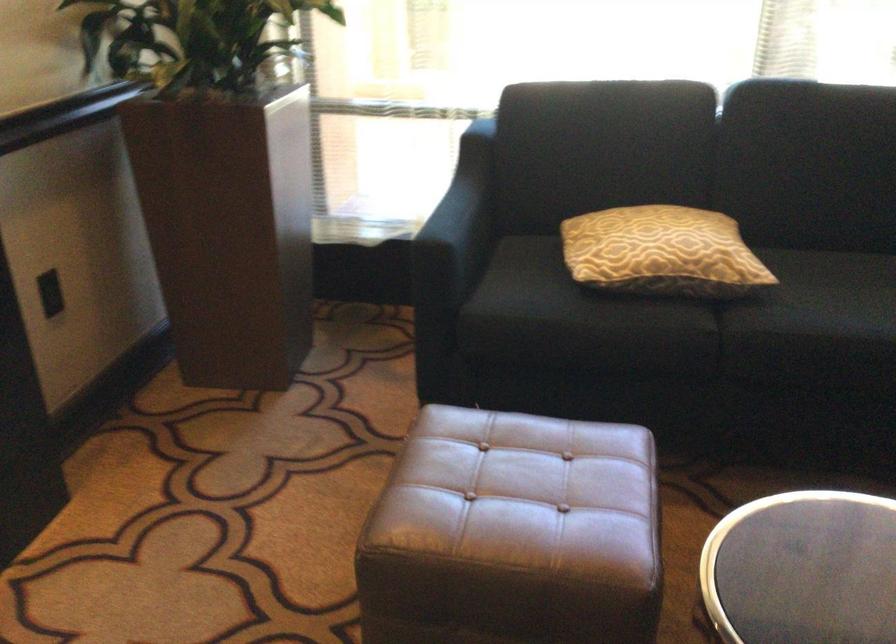
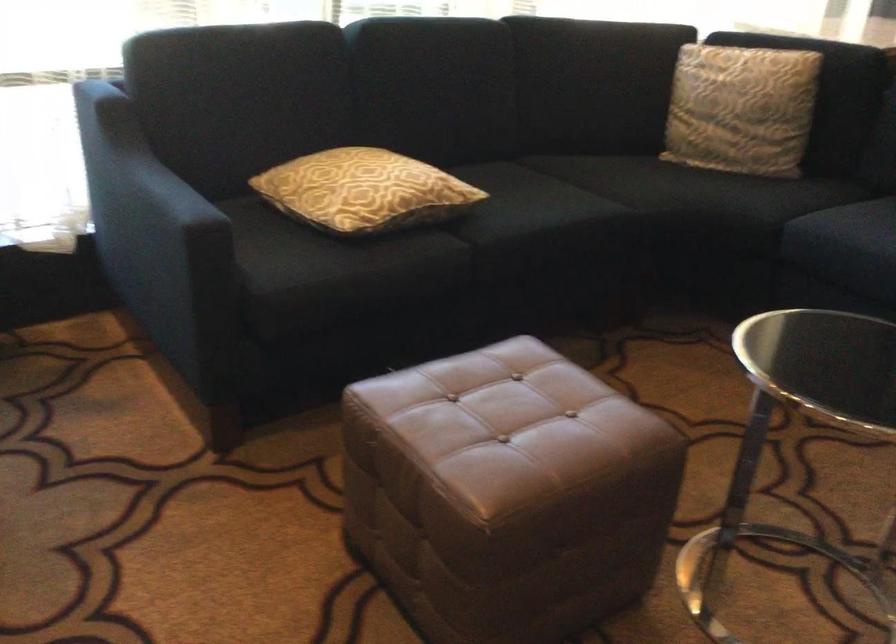
Question: The images are taken continuously from a first-person perspective. In which direction is your viewpoint rotating?

Choices:
 (A) Left
 (B) Right
 (C) Up
 (D) Down

Answer: (B)